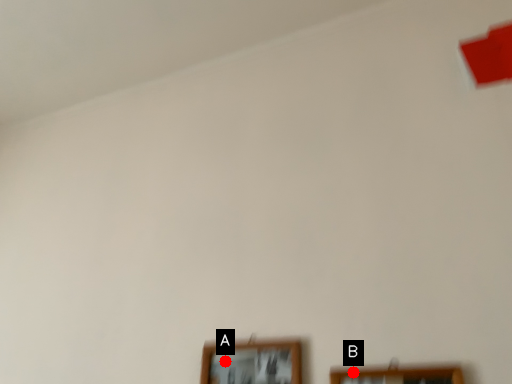
Question: Two points are circled on the image, labeled by A and B beside each circle. Which point is farther from the camera taking this photo?

Choices:
 (A) A is further
 (B) B is further

Answer: (A)